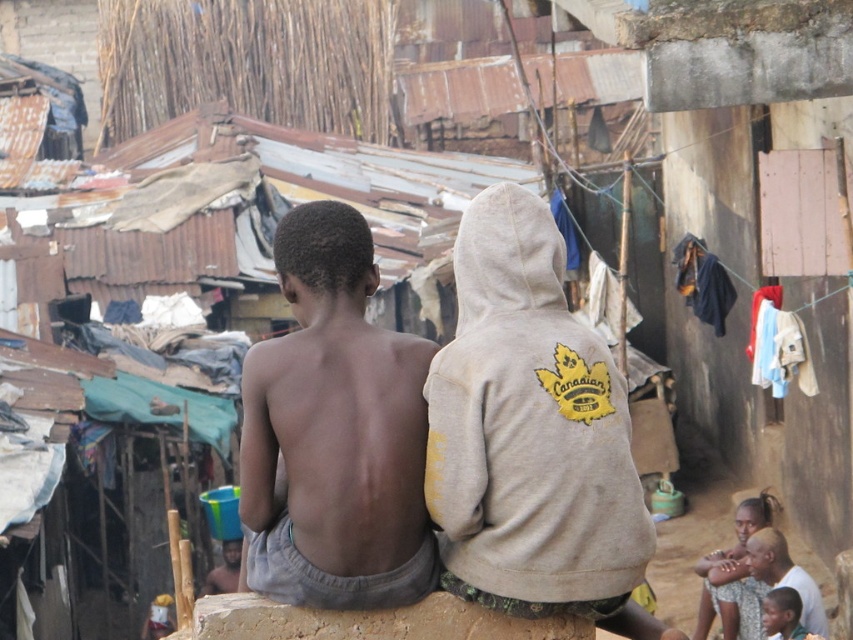
Question: Which is nearer to the light brown skin at lower right?

Choices:
 (A) brown rough stone at lower center
 (B) dark skin/smooth skin/man at center
 (C) light beige hoodie at center

Answer: (C)

Question: Considering the real-world distances, which object is farthest from the brown rough stone at lower center?

Choices:
 (A) dark skin/smooth skin/man at center
 (B) light beige hoodie at center
 (C) light brown skin at center

Answer: (C)

Question: Observing the image, what is the correct spatial positioning of brown rough stone at lower center in reference to light brown skin at lower right?

Choices:
 (A) below
 (B) above

Answer: (B)

Question: Does light beige hoodie at center appear on the left side of light brown skin at lower right?

Choices:
 (A) no
 (B) yes

Answer: (B)

Question: Which of the following is the farthest from the observer?

Choices:
 (A) (564, 598)
 (B) (195, 637)
 (C) (825, 621)
 (D) (764, 497)

Answer: (D)

Question: Can you confirm if dark skin/smooth skin/man at center is positioned above light brown skin at center?

Choices:
 (A) no
 (B) yes

Answer: (B)